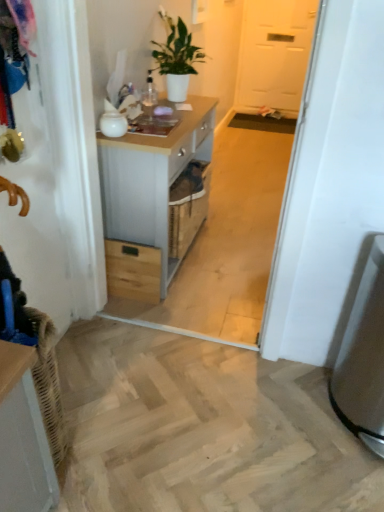
Describe the element at coordinates (155, 199) in the screenshot. I see `white wood chest of drawers at center` at that location.

Find the location of a particular element. The image size is (384, 512). white matte plant at upper center is located at coordinates (176, 57).

Which of these two, white matte door at upper center or satin silver trash can at lower right, is smaller?

With smaller size is satin silver trash can at lower right.

You are a GUI agent. You are given a task and a screenshot of the screen. Output one action in this format:
    pyautogui.click(x=<x>, y=<y>)
    Task: Click on the screen door above the satin silver trash can at lower right (from the image's perspective)
    The width and height of the screenshot is (384, 512).
    Given the screenshot: What is the action you would take?
    pyautogui.click(x=274, y=53)

Is white matte door at upper center positioned with its back to satin silver trash can at lower right?

white matte door at upper center is not turned away from satin silver trash can at lower right.

Who is shorter, satin silver trash can at lower right or wooden drawer at center?

Standing shorter between the two is wooden drawer at center.

Which is in front, satin silver trash can at lower right or wooden drawer at center?

satin silver trash can at lower right is closer to the camera.

Is satin silver trash can at lower right at the left side of wooden drawer at center?

No, satin silver trash can at lower right is not to the left of wooden drawer at center.

Is satin silver trash can at lower right looking in the opposite direction of wooden drawer at center?

That's not correct — satin silver trash can at lower right is not looking away from wooden drawer at center.

Identify the location of houseplant above the satin silver trash can at lower right (from a real-world perspective). Image resolution: width=384 pixels, height=512 pixels. [x=176, y=57].

Is satin silver trash can at lower right thinner than white matte plant at upper center?

In fact, satin silver trash can at lower right might be wider than white matte plant at upper center.

Is satin silver trash can at lower right bigger than white matte plant at upper center?

Indeed, satin silver trash can at lower right has a larger size compared to white matte plant at upper center.

How different are the orientations of wooden drawer at center and white matte door at upper center in degrees?

90.6 degrees.

Between wooden drawer at center and white matte door at upper center, which one has larger size?

With larger size is white matte door at upper center.

From a real-world perspective, between wooden drawer at center and white matte door at upper center, who is vertically lower?

From a 3D spatial view, wooden drawer at center is below.

Which object is positioned more to the right, wooden drawer at center or white matte door at upper center?

Positioned to the right is white matte door at upper center.

Which of these two, white matte door at upper center or white wood chest of drawers at center, is wider?

white wood chest of drawers at center is wider.

How many degrees apart are the facing directions of white matte door at upper center and white wood chest of drawers at center?

90.6 degrees separate the facing orientations of white matte door at upper center and white wood chest of drawers at center.

Who is bigger, white matte door at upper center or white wood chest of drawers at center?

Bigger between the two is white wood chest of drawers at center.

Identify the location of screen door above the white wood chest of drawers at center (from a real-world perspective). The height and width of the screenshot is (512, 384). (274, 53).

Consider the image. Is white matte plant at upper center not near wooden drawer at center?

white matte plant at upper center is positioned a significant distance from wooden drawer at center.

Could you tell me if white matte plant at upper center is turned towards wooden drawer at center?

No, white matte plant at upper center is not turned towards wooden drawer at center.

Based on their positions, is white matte plant at upper center located to the left or right of wooden drawer at center?

In the image, white matte plant at upper center appears on the right side of wooden drawer at center.

Which point is more distant from viewer, (x=189, y=40) or (x=139, y=296)?

Positioned behind is point (x=189, y=40).

Choose the correct answer: Is satin silver trash can at lower right inside white wood chest of drawers at center or outside it?

satin silver trash can at lower right exists outside the volume of white wood chest of drawers at center.

Considering the relative positions of satin silver trash can at lower right and white wood chest of drawers at center in the image provided, is satin silver trash can at lower right behind white wood chest of drawers at center?

No, satin silver trash can at lower right is closer to the viewer.

Who is smaller, satin silver trash can at lower right or white wood chest of drawers at center?

satin silver trash can at lower right is smaller.

This screenshot has height=512, width=384. I want to click on screen door on the right of satin silver trash can at lower right, so click(274, 53).

Identify the location of appliance below the wooden drawer at center (from the image's perspective). (363, 358).

Considering their positions, is satin silver trash can at lower right positioned further to white matte door at upper center than wooden drawer at center?

Based on the image, satin silver trash can at lower right appears to be further to white matte door at upper center.

When comparing their distances from satin silver trash can at lower right, does white matte plant at upper center or white wood chest of drawers at center seem closer?

white wood chest of drawers at center lies closer to satin silver trash can at lower right than the other object.

Which object lies further to the anchor point satin silver trash can at lower right, white matte plant at upper center or wooden drawer at center?

white matte plant at upper center is positioned further to the anchor satin silver trash can at lower right.

Estimate the real-world distances between objects in this image. Which object is closer to satin silver trash can at lower right, white matte door at upper center or wooden drawer at center?

wooden drawer at center lies closer to satin silver trash can at lower right than the other object.

Considering their positions, is white wood chest of drawers at center positioned further to wooden drawer at center than white matte door at upper center?

white matte door at upper center is further to wooden drawer at center.

Based on their spatial positions, is white matte door at upper center or satin silver trash can at lower right closer to white wood chest of drawers at center?

The object closer to white wood chest of drawers at center is satin silver trash can at lower right.

Looking at the image, which one is located closer to white wood chest of drawers at center, white matte door at upper center or white matte plant at upper center?

white matte plant at upper center is closer to white wood chest of drawers at center.

From the image, which object appears to be nearer to white wood chest of drawers at center, white matte plant at upper center or wooden drawer at center?

wooden drawer at center is closer to white wood chest of drawers at center.

This screenshot has width=384, height=512. Find the location of `chest of drawers between wooden drawer at center and satin silver trash can at lower right`. chest of drawers between wooden drawer at center and satin silver trash can at lower right is located at coordinates (155, 199).

Where is `drawer located between white wood chest of drawers at center and white matte door at upper center in the depth direction`? The image size is (384, 512). drawer located between white wood chest of drawers at center and white matte door at upper center in the depth direction is located at coordinates (133, 271).

Find the location of a particular element. Image resolution: width=384 pixels, height=512 pixels. houseplant between satin silver trash can at lower right and white matte door at upper center along the z-axis is located at coordinates (176, 57).

Locate an element on the screen. This screenshot has height=512, width=384. houseplant between white wood chest of drawers at center and white matte door at upper center in the front-back direction is located at coordinates (176, 57).